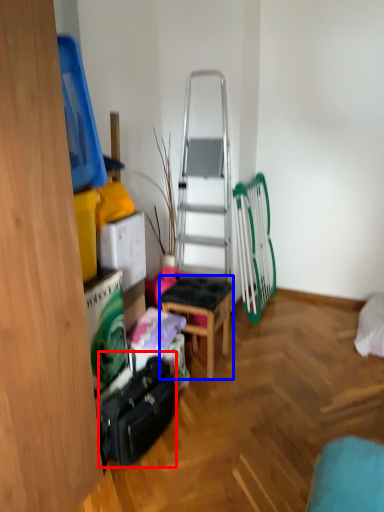
Question: Which of the following is the farthest to the observer, luggage (highlighted by a red box) or stool (highlighted by a blue box)?

Choices:
 (A) luggage
 (B) stool

Answer: (B)